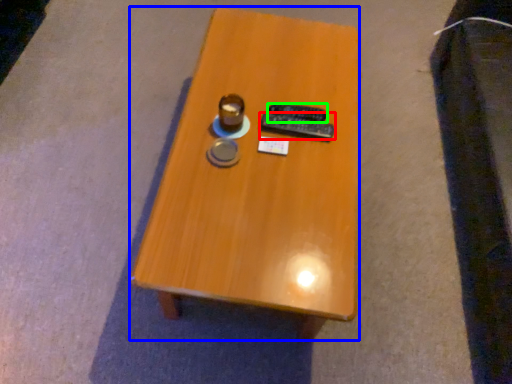
Question: Which is farther away from remote control (highlighted by a red box)? table (highlighted by a blue box) or remote control (highlighted by a green box)?

Choices:
 (A) table
 (B) remote control

Answer: (A)